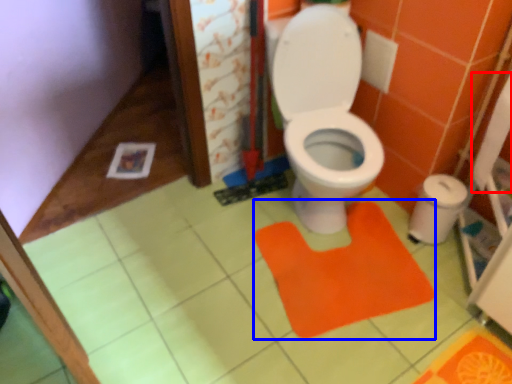
Question: Which object appears farthest to the camera in this image, toilet paper (highlighted by a red box) or doormat (highlighted by a blue box)?

Choices:
 (A) toilet paper
 (B) doormat

Answer: (B)